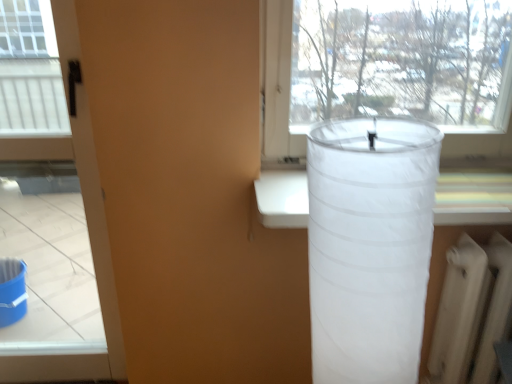
Question: Is matte black screen door at left in front of or behind transparent fabric lampshade at right in the image?

Choices:
 (A) front
 (B) behind

Answer: (B)

Question: Is point (101, 190) closer or farther from the camera than point (415, 347)?

Choices:
 (A) closer
 (B) farther

Answer: (B)

Question: Estimate the real-world distances between objects in this image. Which object is closer to the transparent fabric lampshade at right?

Choices:
 (A) white matte radiator at lower right
 (B) matte black screen door at left

Answer: (A)

Question: Based on their relative distances, which object is nearer to the matte black screen door at left?

Choices:
 (A) transparent fabric lampshade at right
 (B) white matte radiator at lower right

Answer: (A)